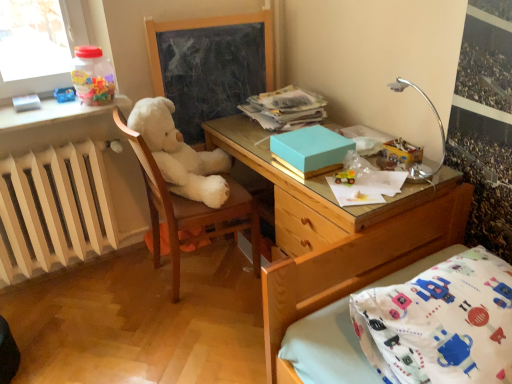
Question: Considering the relative sizes of wooden bed frame at lower right and wooden desk at center in the image provided, is wooden bed frame at lower right taller than wooden desk at center?

Choices:
 (A) yes
 (B) no

Answer: (B)

Question: Would you say wooden desk at center is part of wooden bed frame at lower right's contents?

Choices:
 (A) yes
 (B) no

Answer: (B)

Question: Is wooden bed frame at lower right at the right side of wooden desk at center?

Choices:
 (A) no
 (B) yes

Answer: (B)

Question: Is wooden bed frame at lower right aimed at wooden desk at center?

Choices:
 (A) yes
 (B) no

Answer: (B)

Question: Does wooden bed frame at lower right have a smaller size compared to wooden desk at center?

Choices:
 (A) yes
 (B) no

Answer: (A)

Question: Is wooden bed frame at lower right turned away from wooden desk at center?

Choices:
 (A) yes
 (B) no

Answer: (B)

Question: Is white painted radiator at left facing away from smooth blackboard at center?

Choices:
 (A) no
 (B) yes

Answer: (A)

Question: Considering the relative sizes of white painted radiator at left and smooth blackboard at center in the image provided, is white painted radiator at left wider than smooth blackboard at center?

Choices:
 (A) yes
 (B) no

Answer: (A)

Question: Considering the relative sizes of white painted radiator at left and smooth blackboard at center in the image provided, is white painted radiator at left smaller than smooth blackboard at center?

Choices:
 (A) yes
 (B) no

Answer: (B)

Question: Is white painted radiator at left taller than smooth blackboard at center?

Choices:
 (A) no
 (B) yes

Answer: (A)

Question: Could smooth blackboard at center be considered to be inside white painted radiator at left?

Choices:
 (A) no
 (B) yes

Answer: (A)

Question: From a real-world perspective, does white painted radiator at left stand above smooth blackboard at center?

Choices:
 (A) yes
 (B) no

Answer: (B)

Question: Would you say white painted radiator at left is outside wooden bed frame at lower right?

Choices:
 (A) no
 (B) yes

Answer: (B)